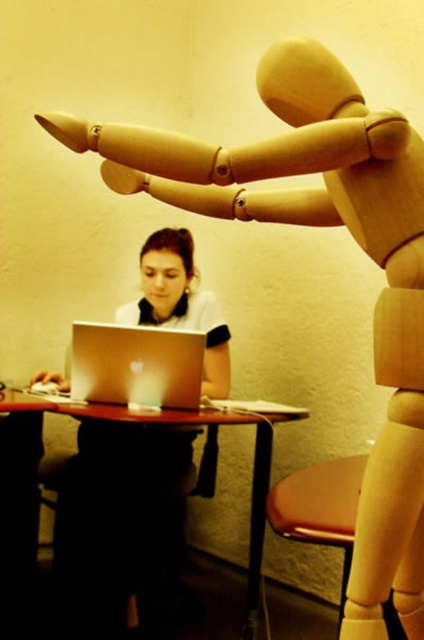
Question: Which object is the closest to the matte white laptop at center?

Choices:
 (A) wooden table at lower center
 (B) silver metallic laptop at center

Answer: (B)

Question: Which point is closer to the camera?

Choices:
 (A) (155, 428)
 (B) (147, 353)
 (C) (30, 410)

Answer: (C)

Question: Is silver metallic laptop at center below wooden table at lower center?

Choices:
 (A) no
 (B) yes

Answer: (A)

Question: Considering the real-world distances, which object is closest to the silver metallic laptop at center?

Choices:
 (A) wooden table at lower center
 (B) matte white laptop at center

Answer: (A)

Question: Is matte white laptop at center smaller than silver metallic laptop at center?

Choices:
 (A) yes
 (B) no

Answer: (B)

Question: Can you confirm if matte white laptop at center is positioned to the left of silver metallic laptop at center?

Choices:
 (A) yes
 (B) no

Answer: (A)